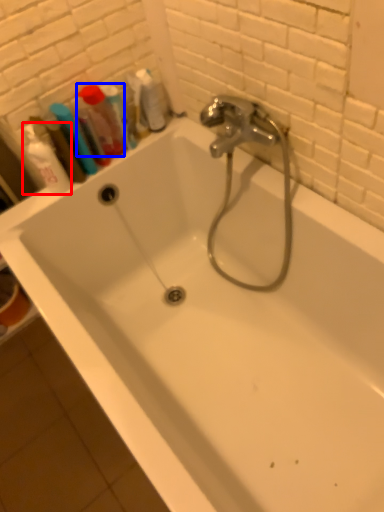
Question: Among these objects, which one is nearest to the camera, shaving cream (highlighted by a red box) or mouthwash (highlighted by a blue box)?

Choices:
 (A) shaving cream
 (B) mouthwash

Answer: (A)